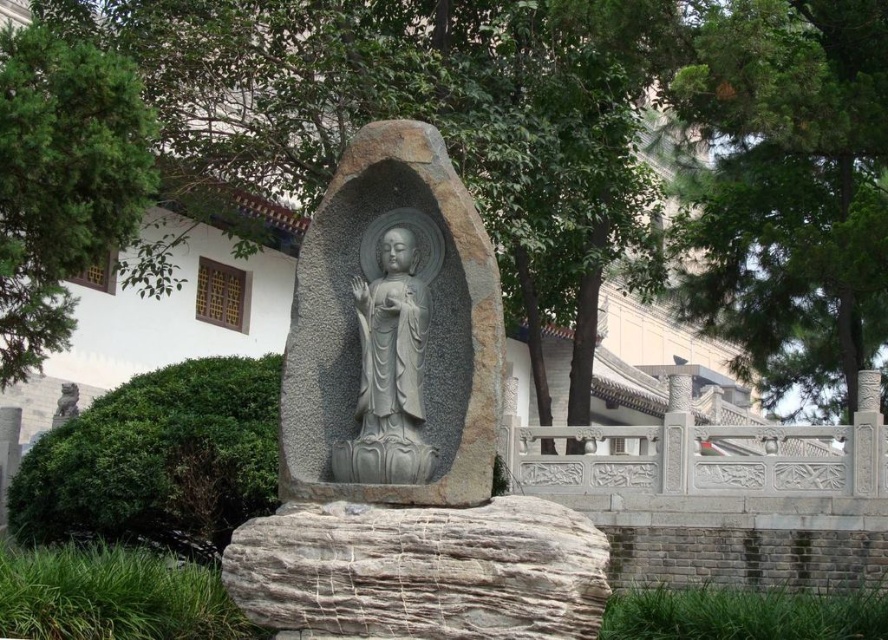
Question: Which point appears closest to the camera in this image?

Choices:
 (A) (707, 88)
 (B) (779, 240)
 (C) (375, 308)

Answer: (C)

Question: Does green leafy tree at center have a smaller size compared to green leafy tree at upper left?

Choices:
 (A) yes
 (B) no

Answer: (B)

Question: Does green leafy tree at upper right have a greater width compared to gray stone statue at center?

Choices:
 (A) yes
 (B) no

Answer: (A)

Question: Which of the following is the farthest from the observer?

Choices:
 (A) (385, 424)
 (B) (797, 298)

Answer: (B)

Question: Which point is closer to the camera taking this photo?

Choices:
 (A) (131, 179)
 (B) (338, 93)

Answer: (A)

Question: Is green leafy tree at upper right wider than gray stone statue at center?

Choices:
 (A) no
 (B) yes

Answer: (B)